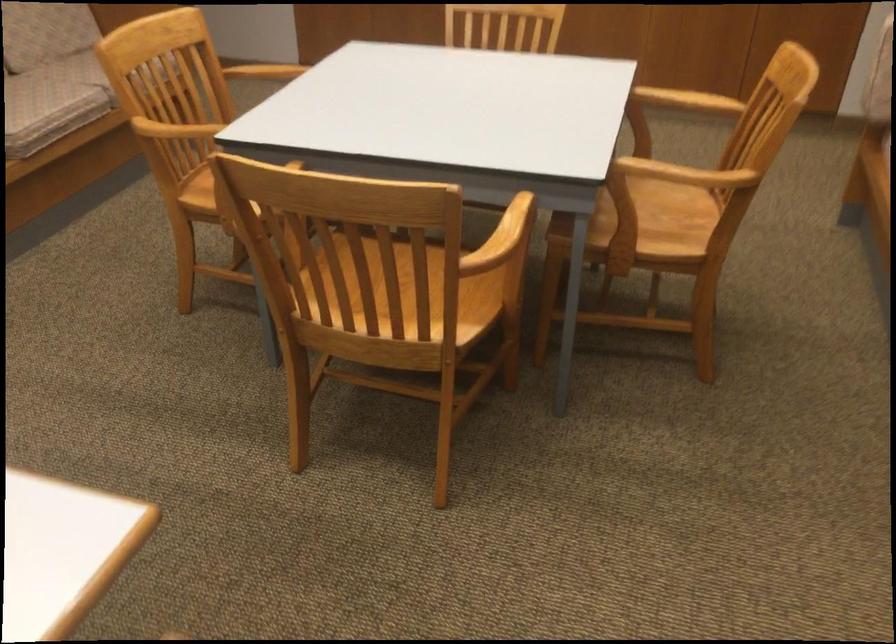
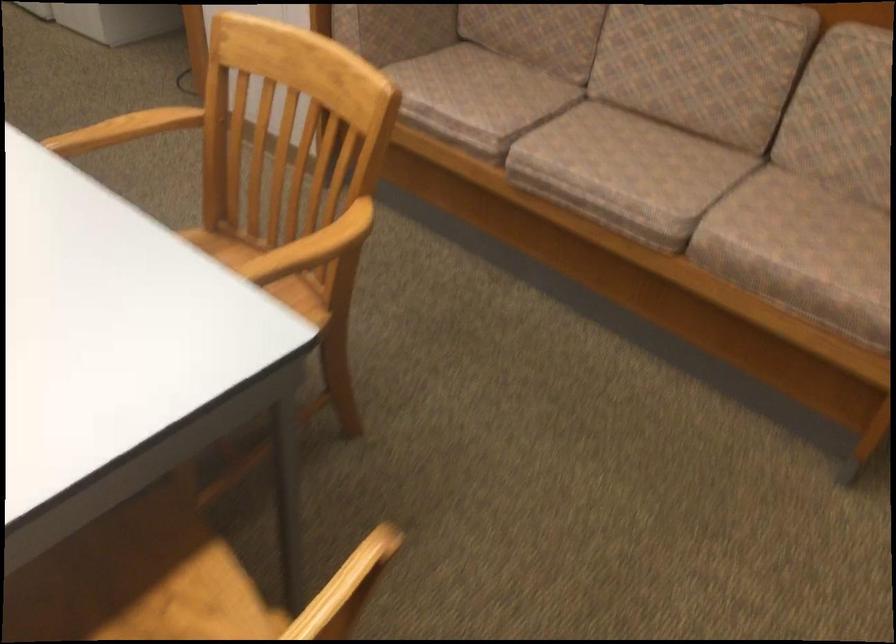
Locate, in the second image, the point that corresponds to point (159, 129) in the first image.

(151, 122)